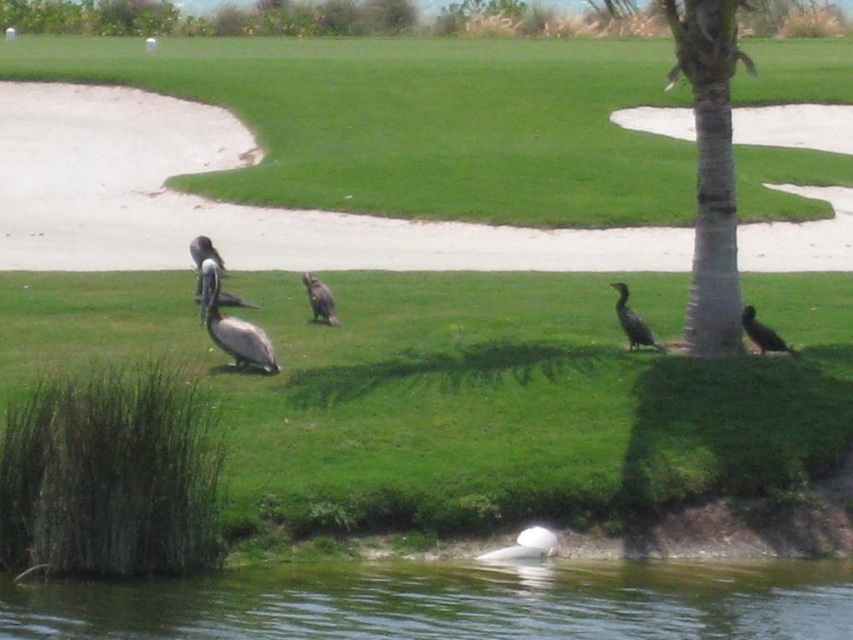
Question: Is brown matte pelican at center positioned in front of white feathered duck at lower center?

Choices:
 (A) no
 (B) yes

Answer: (A)

Question: Which point is farther from the camera taking this photo?

Choices:
 (A) (726, 236)
 (B) (231, 321)

Answer: (A)

Question: Does white textured palm tree at right appear on the left side of brown fuzzy bird at center?

Choices:
 (A) no
 (B) yes

Answer: (A)

Question: Among these objects, which one is farthest from the camera?

Choices:
 (A) white textured palm tree at right
 (B) greenish water at lower center
 (C) white feathered duck at lower center

Answer: (A)

Question: Estimate the real-world distances between objects in this image. Which object is farther from the brown matte pelican at center?

Choices:
 (A) black matte bird at center
 (B) dark brown feathers at center
 (C) brown feathered pelican at upper left

Answer: (B)

Question: Is white textured palm tree at right to the left of white feathered duck at lower center from the viewer's perspective?

Choices:
 (A) yes
 (B) no

Answer: (B)